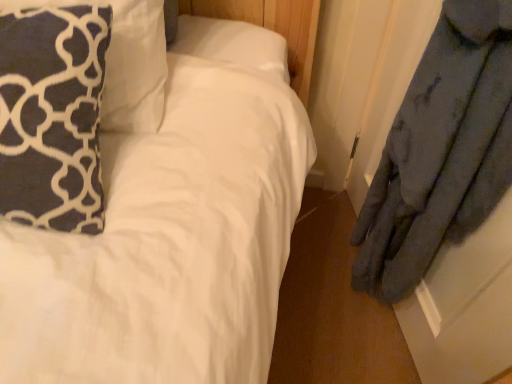
Question: Considering the relative sizes of dark blue plush pillow at upper left, which is counted as the first pillow, starting from the bottom, and dark blue fabric pillow at upper left, the first pillow in the top-to-bottom sequence, in the image provided, is dark blue plush pillow at upper left, which is counted as the first pillow, starting from the bottom, smaller than dark blue fabric pillow at upper left, the first pillow in the top-to-bottom sequence,?

Choices:
 (A) yes
 (B) no

Answer: (A)

Question: From a real-world perspective, is dark blue plush pillow at upper left, arranged as the 2th pillow when viewed from the top, on top of dark blue fabric pillow at upper left, arranged as the second pillow when ordered from the bottom?

Choices:
 (A) no
 (B) yes

Answer: (B)

Question: Does dark blue plush pillow at upper left, arranged as the 2th pillow when viewed from the top, have a lesser height compared to dark blue fabric pillow at upper left, the first pillow in the top-to-bottom sequence?

Choices:
 (A) yes
 (B) no

Answer: (A)

Question: Is dark blue plush pillow at upper left, arranged as the 2th pillow when viewed from the top, positioned beyond the bounds of dark blue fabric pillow at upper left, arranged as the second pillow when ordered from the bottom?

Choices:
 (A) yes
 (B) no

Answer: (A)

Question: Is dark blue plush pillow at upper left, arranged as the 2th pillow when viewed from the top, oriented away from dark blue fabric pillow at upper left, arranged as the second pillow when ordered from the bottom?

Choices:
 (A) yes
 (B) no

Answer: (A)

Question: Considering the relative sizes of dark blue plush pillow at upper left, arranged as the 2th pillow when viewed from the top, and dark blue fabric pillow at upper left, arranged as the second pillow when ordered from the bottom, in the image provided, is dark blue plush pillow at upper left, arranged as the 2th pillow when viewed from the top, bigger than dark blue fabric pillow at upper left, arranged as the second pillow when ordered from the bottom,?

Choices:
 (A) yes
 (B) no

Answer: (B)

Question: Is dark blue fabric pillow at upper left, arranged as the second pillow when ordered from the bottom, oriented towards dark blue plush pillow at upper left, which is counted as the first pillow, starting from the bottom?

Choices:
 (A) no
 (B) yes

Answer: (B)

Question: Is dark blue plush pillow at upper left, which is counted as the first pillow, starting from the bottom, a part of dark blue fabric pillow at upper left, arranged as the second pillow when ordered from the bottom?

Choices:
 (A) no
 (B) yes

Answer: (A)

Question: Is dark blue fabric pillow at upper left, the first pillow in the top-to-bottom sequence, smaller than dark blue plush pillow at upper left, arranged as the 2th pillow when viewed from the top?

Choices:
 (A) no
 (B) yes

Answer: (A)

Question: Is dark blue fabric pillow at upper left, arranged as the second pillow when ordered from the bottom, at the right side of dark blue plush pillow at upper left, which is counted as the first pillow, starting from the bottom?

Choices:
 (A) no
 (B) yes

Answer: (B)

Question: Is dark blue fabric pillow at upper left, the first pillow in the top-to-bottom sequence, bigger than dark blue plush pillow at upper left, which is counted as the first pillow, starting from the bottom?

Choices:
 (A) no
 (B) yes

Answer: (B)

Question: From a real-world perspective, is dark blue fabric pillow at upper left, arranged as the second pillow when ordered from the bottom, positioned over dark blue plush pillow at upper left, which is counted as the first pillow, starting from the bottom, based on gravity?

Choices:
 (A) no
 (B) yes

Answer: (A)

Question: Considering the positions of point (62, 150) and point (146, 44), is point (62, 150) closer or farther from the camera than point (146, 44)?

Choices:
 (A) farther
 (B) closer

Answer: (B)